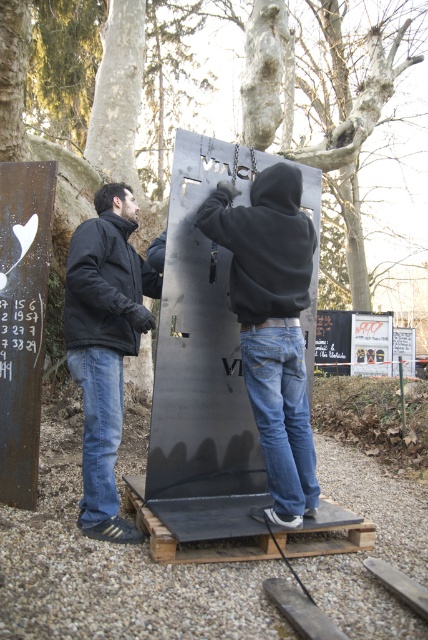
Can you confirm if smooth bark tree at upper center is positioned below black matte sweatshirt at center?

Incorrect, smooth bark tree at upper center is not positioned below black matte sweatshirt at center.

Which is behind, point (18, 13) or point (285, 314)?

The point (18, 13) is more distant.

The height and width of the screenshot is (640, 428). I want to click on smooth bark tree at upper center, so click(x=91, y=113).

Based on the photo, is black matte sweatshirt at center further to camera compared to black matte sweatshirt at left?

Yes, black matte sweatshirt at center is behind black matte sweatshirt at left.

Locate an element on the screen. black matte sweatshirt at center is located at coordinates (264, 244).

Which is more to the left, black matte jacket at left or black matte sweatshirt at left?

black matte jacket at left

Describe the element at coordinates (104, 346) in the screenshot. I see `black matte jacket at left` at that location.

Identify the location of black matte jacket at left. (104, 346).